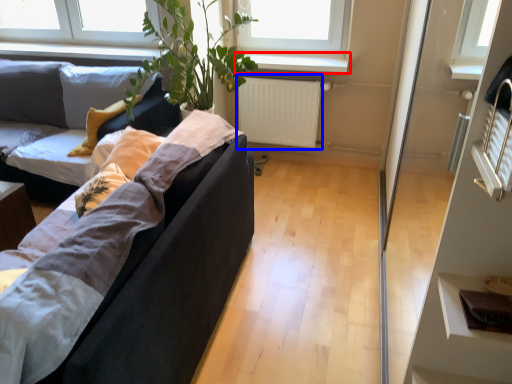
Question: Which of the following is the closest to the observer, window sill (highlighted by a red box) or radiator (highlighted by a blue box)?

Choices:
 (A) window sill
 (B) radiator

Answer: (A)